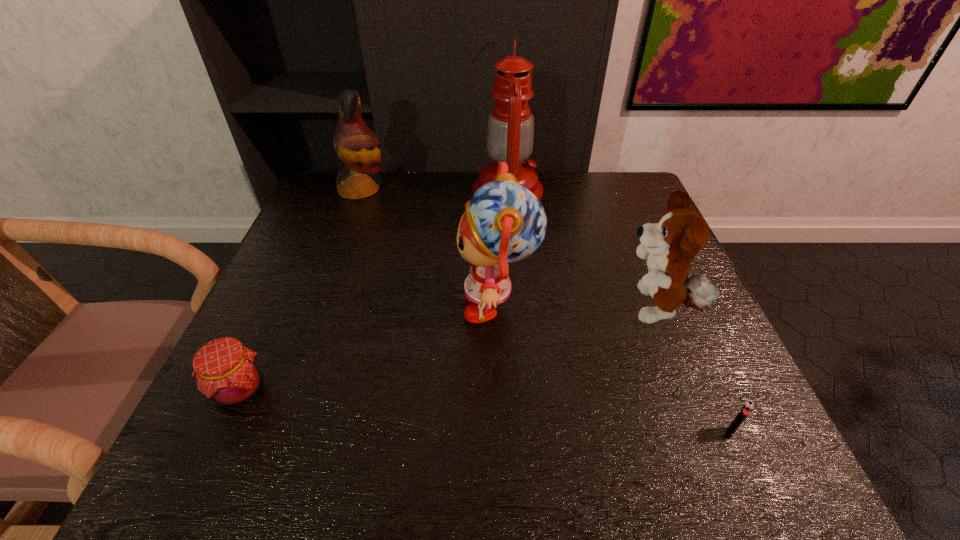
The height and width of the screenshot is (540, 960). Identify the location of oil lamp. (510, 130).

Locate an element on the screen. This screenshot has height=540, width=960. parrot is located at coordinates (356, 145).

This screenshot has height=540, width=960. I want to click on doll, so click(504, 222).

The image size is (960, 540). Find the location of `puppy`. puppy is located at coordinates (668, 246).

Image resolution: width=960 pixels, height=540 pixels. Identify the location of the fifth farthest object. (226, 371).

Where is `jam`? jam is located at coordinates (226, 371).

Locate an element on the screen. The height and width of the screenshot is (540, 960). the nearest object is located at coordinates (748, 406).

The height and width of the screenshot is (540, 960). Identify the location of igniter. (748, 406).

Where is `free space located 0.080m on the left of the tallest object`? free space located 0.080m on the left of the tallest object is located at coordinates (444, 191).

The height and width of the screenshot is (540, 960). Identify the location of vacant space located on the face of the parrot. (424, 190).